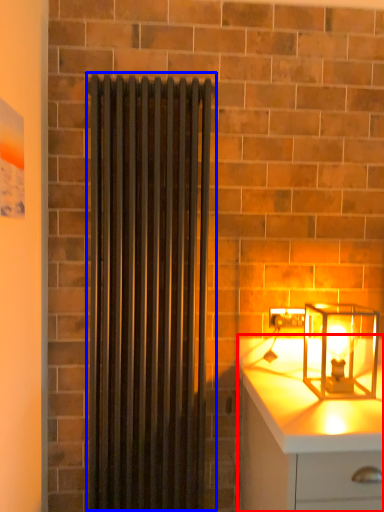
Question: Which point is further to the camera, chest of drawers (highlighted by a red box) or shower curtain (highlighted by a blue box)?

Choices:
 (A) chest of drawers
 (B) shower curtain

Answer: (B)